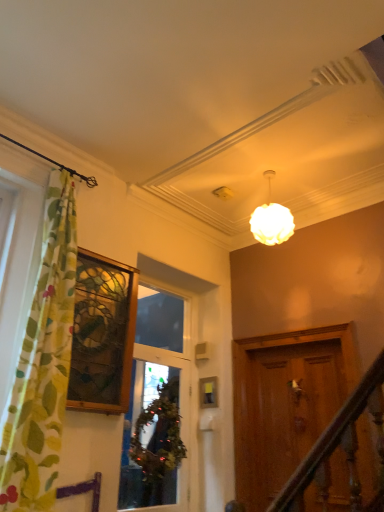
I want to click on matte white globe at upper center, so click(x=271, y=219).

Identify the location of stained glass window at left, which appears as the 1th window when viewed from the left. (102, 334).

Describe the element at coordinates (102, 334) in the screenshot. I see `stained glass window at left, which appears as the 1th window when viewed from the left` at that location.

This screenshot has height=512, width=384. I want to click on matte white globe at upper center, so click(271, 219).

Between stained glass window at left, which appears as the 1th window when viewed from the left, and matte white globe at upper center, which one has larger size?

stained glass window at left, which appears as the 1th window when viewed from the left.

Is stained glass window at left, which is the second window from right to left, oriented away from matte white globe at upper center?

No, stained glass window at left, which is the second window from right to left, is not facing away from matte white globe at upper center.

From a real-world perspective, does stained glass window at left, which appears as the 1th window when viewed from the left, sit lower than matte white globe at upper center?

Correct, in the physical world, stained glass window at left, which appears as the 1th window when viewed from the left, is lower than matte white globe at upper center.

Considering the positions of objects stained glass window at left, which is the second window from right to left, and matte white globe at upper center in the image provided, who is more to the left, stained glass window at left, which is the second window from right to left, or matte white globe at upper center?

Positioned to the left is stained glass window at left, which is the second window from right to left.

Considering the sizes of objects matte white globe at upper center and green leafy wreath at center in the image provided, who is bigger, matte white globe at upper center or green leafy wreath at center?

green leafy wreath at center.

Which object is thinner, matte white globe at upper center or green leafy wreath at center?

With smaller width is green leafy wreath at center.

Is matte white globe at upper center directly adjacent to green leafy wreath at center?

No.

Which is more to the left, stained glass window at left, which appears as the 1th window when viewed from the left, or green fabric wreath at center, positioned as the 1th window in right-to-left order?

From the viewer's perspective, stained glass window at left, which appears as the 1th window when viewed from the left, appears more on the left side.

Based on the photo, is there a large distance between stained glass window at left, which is the second window from right to left, and green fabric wreath at center, positioned as the 1th window in right-to-left order?

No.

Can you confirm if stained glass window at left, which is the second window from right to left, is smaller than green fabric wreath at center, positioned as the 1th window in right-to-left order?

Indeed, stained glass window at left, which is the second window from right to left, has a smaller size compared to green fabric wreath at center, positioned as the 1th window in right-to-left order.

Which object is closer to the camera, stained glass window at left, which is the second window from right to left, or green fabric wreath at center, positioned as the 1th window in right-to-left order?

Positioned in front is stained glass window at left, which is the second window from right to left.

Is green floral fabric curtain at left at the back of stained glass window at left, which appears as the 1th window when viewed from the left?

stained glass window at left, which appears as the 1th window when viewed from the left, does not have its back to green floral fabric curtain at left.

Is green floral fabric curtain at left a part of stained glass window at left, which appears as the 1th window when viewed from the left?

No.

From the image's perspective, is stained glass window at left, which is the second window from right to left, on green floral fabric curtain at left?

→ No, from the image's perspective, stained glass window at left, which is the second window from right to left, is not above green floral fabric curtain at left.

From a real-world perspective, is stained glass window at left, which is the second window from right to left, on green floral fabric curtain at left?

Correct, in the physical world, stained glass window at left, which is the second window from right to left, is higher than green floral fabric curtain at left.

Is green leafy wreath at center to the left of stained glass window at left, which appears as the 1th window when viewed from the left, from the viewer's perspective?

No, green leafy wreath at center is not to the left of stained glass window at left, which appears as the 1th window when viewed from the left.

Is point (159, 412) closer or farther from the camera than point (85, 402)?

Point (159, 412) is positioned farther from the camera compared to point (85, 402).

Looking at this image, in the image, is green leafy wreath at center positioned in front of or behind stained glass window at left, which is the second window from right to left?

Clearly, green leafy wreath at center is behind stained glass window at left, which is the second window from right to left.

From the image's perspective, which one is positioned higher, green leafy wreath at center or stained glass window at left, which is the second window from right to left?

stained glass window at left, which is the second window from right to left, appears higher in the image.

From a real-world perspective, is green floral fabric curtain at left positioned above or below stained glass window at left, which appears as the 1th window when viewed from the left?

green floral fabric curtain at left is situated lower than stained glass window at left, which appears as the 1th window when viewed from the left, in the real world.

Is green floral fabric curtain at left not within stained glass window at left, which is the second window from right to left?

Indeed, green floral fabric curtain at left is completely outside stained glass window at left, which is the second window from right to left.

Considering their positions, is green floral fabric curtain at left located in front of or behind stained glass window at left, which is the second window from right to left?

Clearly, green floral fabric curtain at left is in front of stained glass window at left, which is the second window from right to left.

From the image's perspective, is green floral fabric curtain at left located above or below stained glass window at left, which appears as the 1th window when viewed from the left?

From the image's perspective, green floral fabric curtain at left appears above stained glass window at left, which appears as the 1th window when viewed from the left.

From the image's perspective, which is above, matte white globe at upper center or green fabric wreath at center, which is the 2th window in left-to-right order?

matte white globe at upper center, from the image's perspective.

How different are the orientations of matte white globe at upper center and green fabric wreath at center, positioned as the 1th window in right-to-left order, in degrees?

The angular difference between matte white globe at upper center and green fabric wreath at center, positioned as the 1th window in right-to-left order, is 90.7 degrees.

Is matte white globe at upper center not inside green fabric wreath at center, which is the 2th window in left-to-right order?

matte white globe at upper center is positioned outside green fabric wreath at center, which is the 2th window in left-to-right order.

From a real-world perspective, who is located lower, matte white globe at upper center or green fabric wreath at center, positioned as the 1th window in right-to-left order?

green fabric wreath at center, positioned as the 1th window in right-to-left order, is physically lower.

Find the location of `lamp lying above the stained glass window at left, which is the second window from right to left (from the image's perspective)`. lamp lying above the stained glass window at left, which is the second window from right to left (from the image's perspective) is located at coordinates (271, 219).

This screenshot has width=384, height=512. I want to click on plant lying behind the matte white globe at upper center, so click(159, 435).

Looking at the image, which one is located further to stained glass window at left, which is the second window from right to left, green leafy wreath at center or green floral fabric curtain at left?

green leafy wreath at center is positioned further to the anchor stained glass window at left, which is the second window from right to left.

Estimate the real-world distances between objects in this image. Which object is further from stained glass window at left, which appears as the 1th window when viewed from the left, matte white globe at upper center or green fabric wreath at center, positioned as the 1th window in right-to-left order?

matte white globe at upper center is positioned further to the anchor stained glass window at left, which appears as the 1th window when viewed from the left.

Based on their spatial positions, is green floral fabric curtain at left or matte white globe at upper center closer to green fabric wreath at center, positioned as the 1th window in right-to-left order?

The object closer to green fabric wreath at center, positioned as the 1th window in right-to-left order, is green floral fabric curtain at left.

Based on their spatial positions, is green floral fabric curtain at left or stained glass window at left, which is the second window from right to left, further from green fabric wreath at center, positioned as the 1th window in right-to-left order?

green floral fabric curtain at left lies further to green fabric wreath at center, positioned as the 1th window in right-to-left order, than the other object.

Based on their spatial positions, is green floral fabric curtain at left or stained glass window at left, which appears as the 1th window when viewed from the left, further from matte white globe at upper center?

Among the two, green floral fabric curtain at left is located further to matte white globe at upper center.

From the image, which object appears to be nearer to green fabric wreath at center, positioned as the 1th window in right-to-left order, stained glass window at left, which appears as the 1th window when viewed from the left, or green floral fabric curtain at left?

The object closer to green fabric wreath at center, positioned as the 1th window in right-to-left order, is stained glass window at left, which appears as the 1th window when viewed from the left.

Considering their positions, is stained glass window at left, which appears as the 1th window when viewed from the left, positioned closer to green fabric wreath at center, which is the 2th window in left-to-right order, than matte white globe at upper center?

stained glass window at left, which appears as the 1th window when viewed from the left, is positioned closer to the anchor green fabric wreath at center, which is the 2th window in left-to-right order.

Based on their spatial positions, is stained glass window at left, which appears as the 1th window when viewed from the left, or green leafy wreath at center further from green fabric wreath at center, positioned as the 1th window in right-to-left order?

stained glass window at left, which appears as the 1th window when viewed from the left, is further to green fabric wreath at center, positioned as the 1th window in right-to-left order.

This screenshot has width=384, height=512. I want to click on window between stained glass window at left, which is the second window from right to left, and green leafy wreath at center, in the vertical direction, so click(x=157, y=405).

Locate an element on the screen. The height and width of the screenshot is (512, 384). window that lies between matte white globe at upper center and green fabric wreath at center, positioned as the 1th window in right-to-left order, from top to bottom is located at coordinates (102, 334).

At what (x,y) coordinates should I click in order to perform the action: click on window between green floral fabric curtain at left and green fabric wreath at center, which is the 2th window in left-to-right order, in the front-back direction. Please return your answer as a coordinate pair (x, y). Looking at the image, I should click on (102, 334).

This screenshot has width=384, height=512. What are the coordinates of `curtain between matte white globe at upper center and green fabric wreath at center, which is the 2th window in left-to-right order, from top to bottom` in the screenshot? It's located at (43, 362).